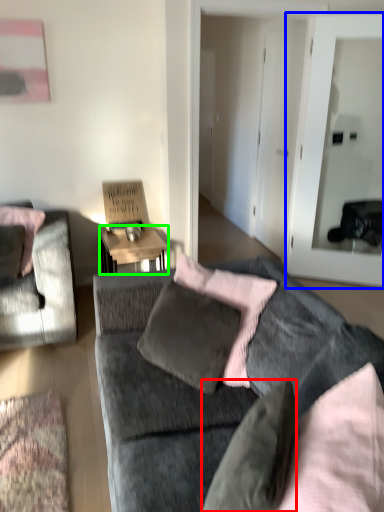
Question: Estimate the real-world distances between objects in this image. Which object is farther from pillow (highlighted by a red box), glass door (highlighted by a blue box) or desk (highlighted by a green box)?

Choices:
 (A) glass door
 (B) desk

Answer: (A)